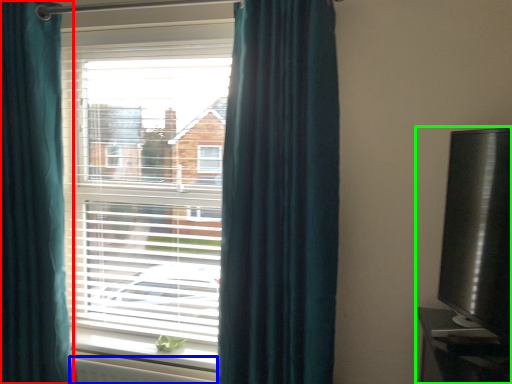
Question: Estimate the real-world distances between objects in this image. Which object is farther from curtain (highlighted by a red box), radiator (highlighted by a blue box) or entertainment center (highlighted by a green box)?

Choices:
 (A) radiator
 (B) entertainment center

Answer: (B)